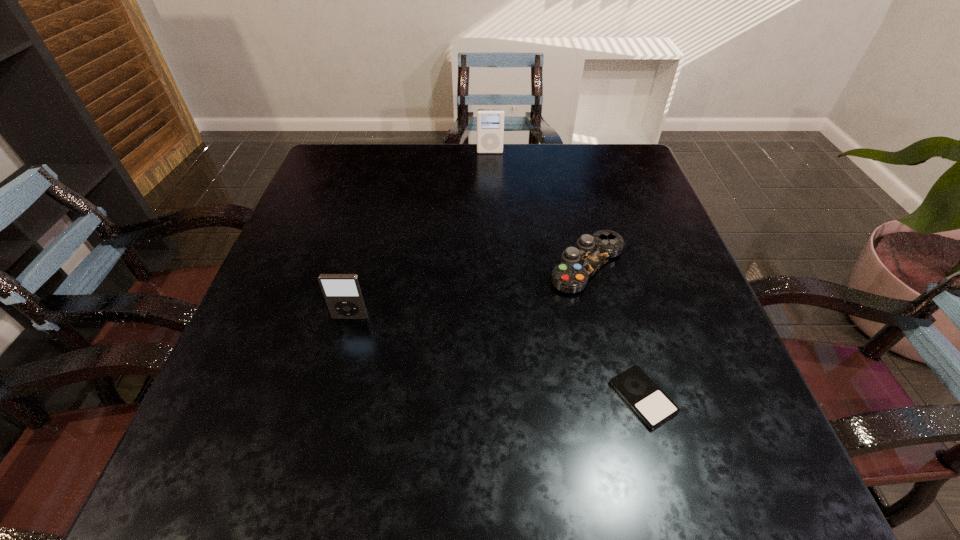
Locate an element on the screen. The width and height of the screenshot is (960, 540). the second object from left to right is located at coordinates (490, 122).

Locate an element on the screen. The width and height of the screenshot is (960, 540). the farthest iPod is located at coordinates (490, 122).

The image size is (960, 540). Find the location of `the leftmost object`. the leftmost object is located at coordinates (342, 292).

The width and height of the screenshot is (960, 540). Identify the location of the second nearest object. (342, 292).

In order to click on the third nearest object in this screenshot , I will do `click(577, 265)`.

Image resolution: width=960 pixels, height=540 pixels. Identify the location of the third tallest object. (577, 265).

The image size is (960, 540). I want to click on the nearest iPod, so pos(650,403).

Locate an element on the screen. the shortest iPod is located at coordinates (650, 403).

Where is `vacant space located on the front-facing side of the second object from left to right`? vacant space located on the front-facing side of the second object from left to right is located at coordinates (491, 176).

Where is `vacant space located on the front-facing side of the second nearest iPod`? The height and width of the screenshot is (540, 960). vacant space located on the front-facing side of the second nearest iPod is located at coordinates (312, 465).